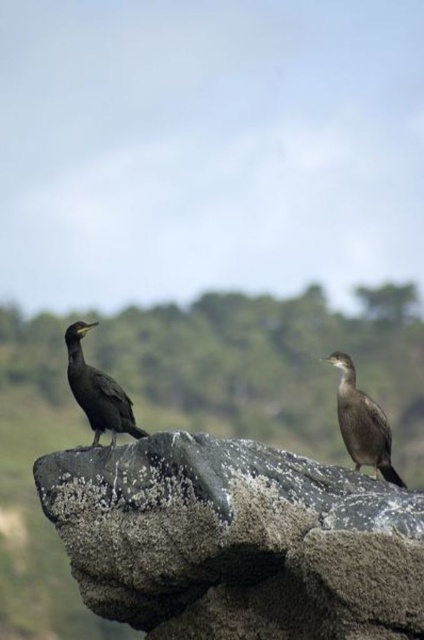
Question: Which object is the closest to the dark brown feathers at left?

Choices:
 (A) gray rough rock at center
 (B) dark brown feathers at right

Answer: (A)

Question: Does dark brown feathers at right have a greater width compared to dark brown feathers at left?

Choices:
 (A) yes
 (B) no

Answer: (B)

Question: Which of the following is the farthest from the observer?

Choices:
 (A) dark brown feathers at right
 (B) gray rough rock at center

Answer: (A)

Question: Does gray rough rock at center appear on the right side of dark brown feathers at left?

Choices:
 (A) no
 (B) yes

Answer: (B)

Question: Which of the following is the closest to the observer?

Choices:
 (A) (119, 390)
 (B) (253, 548)

Answer: (B)

Question: Observing the image, what is the correct spatial positioning of dark brown feathers at right in reference to dark brown feathers at left?

Choices:
 (A) below
 (B) above

Answer: (A)